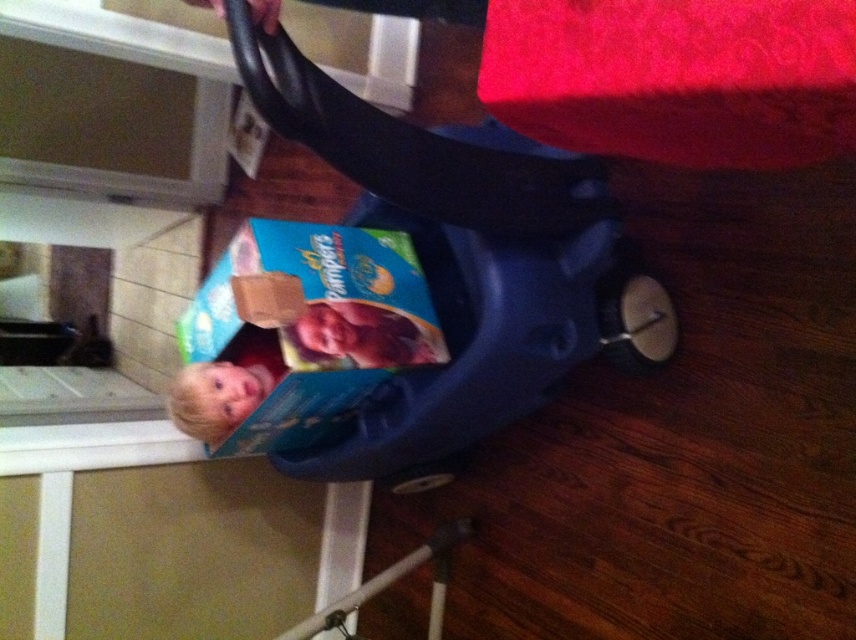
You are a parent holding a 24 inch long package that you need to place on the floor next to the blue plastic baby carriage at center. Can you fit the package next to the carriage without it overlapping the carriage or the red patterned rug in the upper right corner?

The blue plastic baby carriage at center is 35.02 inches away from the viewer. Since the package is only 24 inches long, it can be placed next to the carriage without overlapping as there is sufficient space between the carriage and the rug.

You are a parent trying to locate your baby in a room. You see the point at coordinates [361,336]. What is at that point?

The point at coordinates [361,336] corresponds to a smooth plastic baby at center.

You are a parent holding a baby who needs to be placed in the blue plastic baby carriage at center. The baby is currently 1 meter away from the carriage. Can you reach the baby from your current position without moving closer to the carriage?

The blue plastic baby carriage at center is 88.95 centimeters away from the camera. Since the baby is 1 meter away, which is farther than the carriage, you cannot reach the baby without moving closer to the carriage.